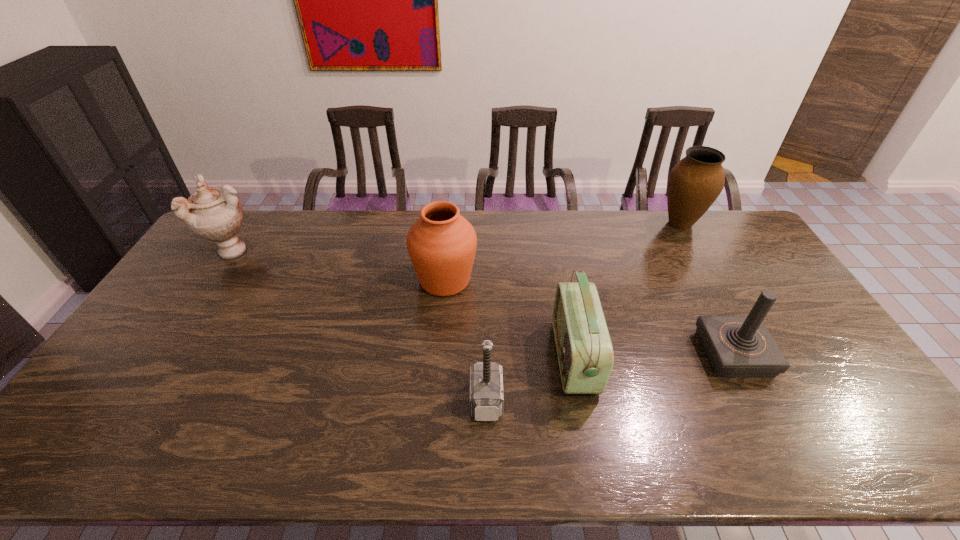
At what (x,y) coordinates should I click in order to perform the action: click on the rightmost urn. Please return your answer as a coordinate pair (x, y). The image size is (960, 540). Looking at the image, I should click on (695, 182).

This screenshot has width=960, height=540. Identify the location of the leftmost urn. (214, 214).

The image size is (960, 540). I want to click on the second urn from left to right, so click(x=441, y=244).

At what (x,y) coordinates should I click in order to perform the action: click on joystick. Please return your answer as a coordinate pair (x, y). This screenshot has width=960, height=540. Looking at the image, I should click on (736, 346).

In order to click on radio receiver in this screenshot , I will do `click(585, 353)`.

Locate an element on the screen. This screenshot has height=540, width=960. hammer is located at coordinates (486, 378).

Identify the location of free space located on the front of the rightmost urn. (704, 266).

Identify the location of vacant space located 0.230m on the front of the leftmost urn. The image size is (960, 540). (191, 320).

I want to click on vacant area situated on the right of the second urn from right to left, so click(495, 280).

Locate an element on the screen. free point located 0.280m on the rectangular base of the joystick is located at coordinates (602, 354).